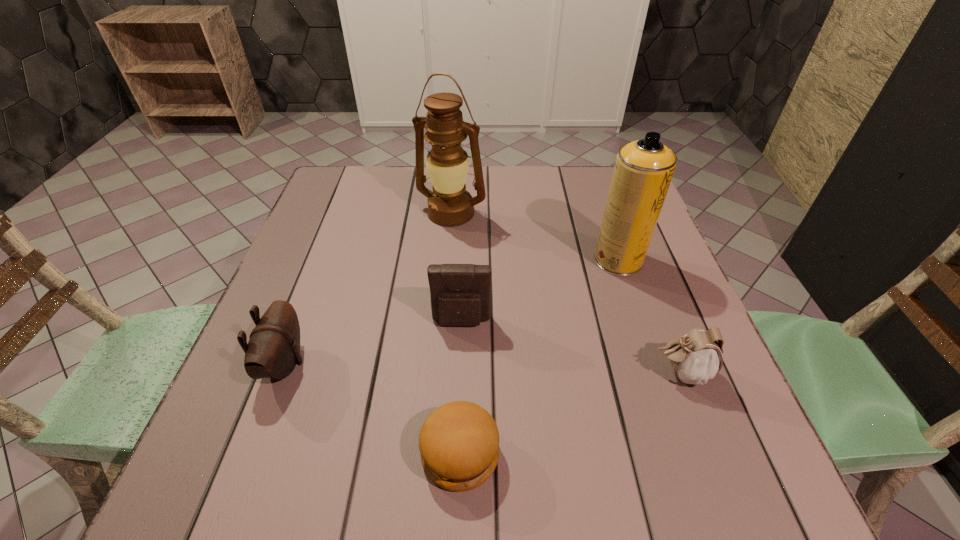
Where is `vacant area situated 0.320m with an open flap on the farthest pouch`? The image size is (960, 540). vacant area situated 0.320m with an open flap on the farthest pouch is located at coordinates (455, 494).

Identify the location of vacant space located with the flap open on the leftmost pouch. This screenshot has width=960, height=540. (460, 363).

Identify the location of free region located on the front-facing side of the rightmost pouch. The image size is (960, 540). (483, 373).

Find the location of `vacant space located 0.400m on the front-facing side of the rightmost pouch`. vacant space located 0.400m on the front-facing side of the rightmost pouch is located at coordinates (441, 373).

What are the coordinates of `free space located on the front-facing side of the rightmost pouch` in the screenshot? It's located at (515, 373).

The image size is (960, 540). In order to click on blank space located on the right of the nearest object in this screenshot , I will do `click(541, 454)`.

Identify the location of object that is at the far edge. The height and width of the screenshot is (540, 960). click(x=450, y=204).

You are a GUI agent. You are given a task and a screenshot of the screen. Output one action in this format:
    pyautogui.click(x=<x>, y=<y>)
    Task: Click on the object that is at the near edge
    The image size is (960, 540).
    Given the screenshot: What is the action you would take?
    pyautogui.click(x=459, y=441)

The image size is (960, 540). In order to click on object that is at the left edge in this screenshot , I will do `click(273, 350)`.

You are a GUI agent. You are given a task and a screenshot of the screen. Output one action in this format:
    pyautogui.click(x=<x>, y=<y>)
    Task: Click on the aerosol can at the right edge
    The image size is (960, 540).
    Given the screenshot: What is the action you would take?
    pyautogui.click(x=643, y=170)